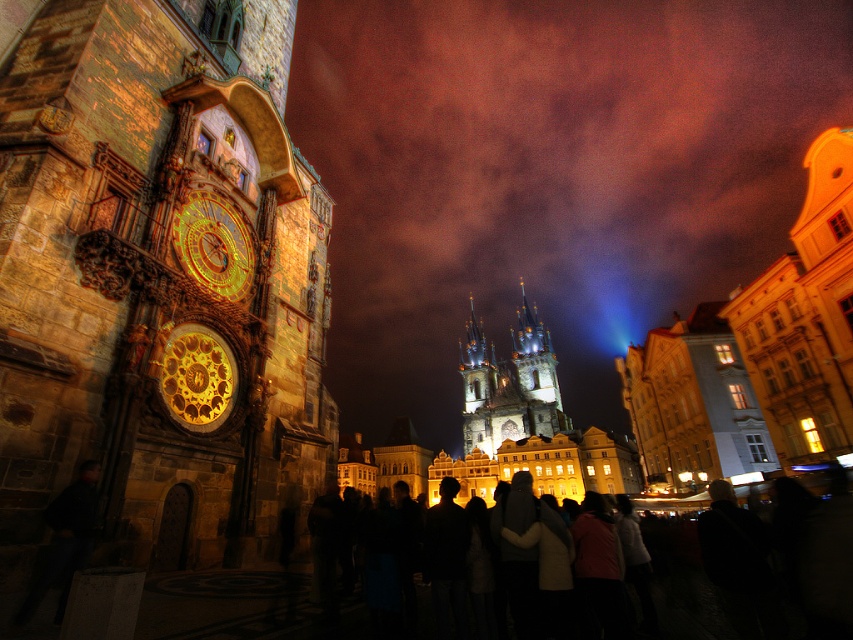
Question: Which object is positioned farthest from the white stone bell tower at center?

Choices:
 (A) golden polished metal clock at left
 (B) golden polished clock at left
 (C) dark clothing crowd at center

Answer: (B)

Question: Is dark clothing crowd at center positioned behind golden polished metal clock at left?

Choices:
 (A) no
 (B) yes

Answer: (A)

Question: Is dark clothing crowd at center to the left of golden polished metal clock at left from the viewer's perspective?

Choices:
 (A) yes
 (B) no

Answer: (B)

Question: Is the position of white stone bell tower at center more distant than that of golden polished metal clock at left?

Choices:
 (A) yes
 (B) no

Answer: (A)

Question: Based on their relative distances, which object is nearer to the white stone bell tower at center?

Choices:
 (A) golden polished metal clock at left
 (B) golden polished clock at left

Answer: (A)

Question: Which object is positioned farthest from the dark clothing crowd at center?

Choices:
 (A) white stone bell tower at center
 (B) golden polished metal clock at left
 (C) golden polished clock at left

Answer: (A)